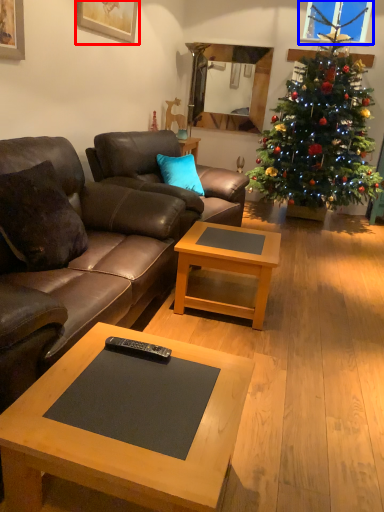
Question: Which of the following is the farthest to the observer, picture frame (highlighted by a red box) or window screen (highlighted by a blue box)?

Choices:
 (A) picture frame
 (B) window screen

Answer: (B)